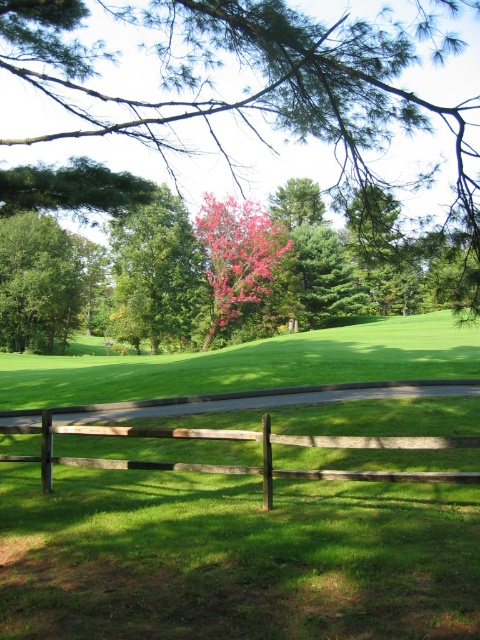
You are a gardener who needs to place a new decorative item between the brown wooden fence at center and the bright pink bark at center. Which object should you place it closer to if you want it to be closer to the smaller object?

The brown wooden fence at center is smaller than the bright pink bark at center, so placing the decorative item closer to the brown wooden fence at center will ensure it is nearer to the smaller object.

You are standing at point A located at coordinates (252, 76) in the image. What object is directly in front of you?

The green leafy tree at center is directly in front of you at point (252, 76).